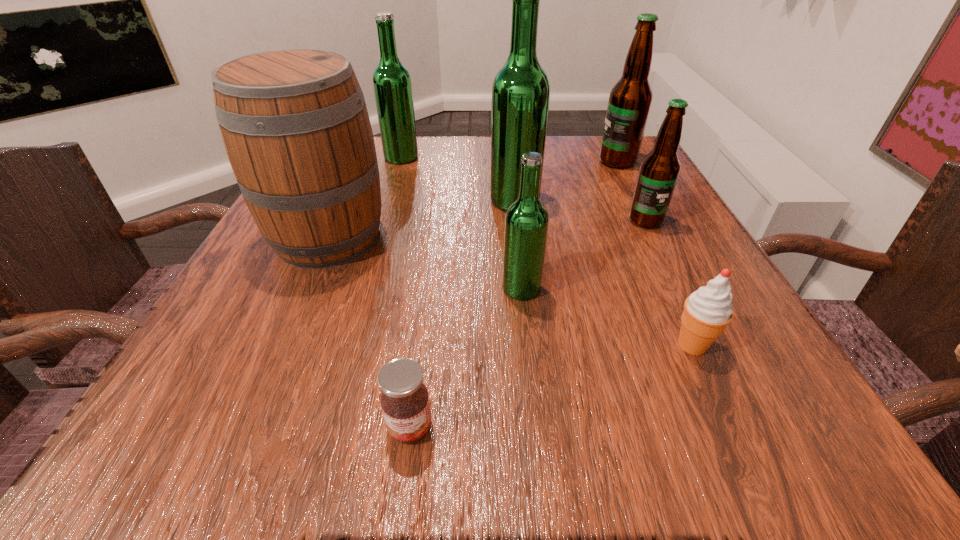
Where is `icecream`? The width and height of the screenshot is (960, 540). icecream is located at coordinates (707, 311).

Identify the location of jam. (405, 403).

Locate an element on the screen. This screenshot has width=960, height=540. the shortest object is located at coordinates (405, 403).

You are a GUI agent. You are given a task and a screenshot of the screen. Output one action in this format:
    pyautogui.click(x=<x>, y=<y>)
    Task: Click on the vacant space positioned on the back of the second nearest green beer bottle
    The width and height of the screenshot is (960, 540).
    Given the screenshot: What is the action you would take?
    pyautogui.click(x=508, y=140)

I want to click on vacant space located 0.390m on the label of the farther brown beer bottle, so click(430, 161).

Identify the location of free space located on the label of the farther brown beer bottle. This screenshot has height=540, width=960. (508, 161).

I want to click on vacant area situated on the label of the farther brown beer bottle, so click(538, 161).

Image resolution: width=960 pixels, height=540 pixels. Identify the location of free space located 0.050m on the left of the second biggest green beer bottle. (363, 157).

Locate an element on the screen. The height and width of the screenshot is (540, 960). vacant area situated 0.230m on the right of the cider is located at coordinates (515, 237).

Locate an element on the screen. This screenshot has width=960, height=540. vacant space positioned on the label of the nearer brown beer bottle is located at coordinates pos(699,327).